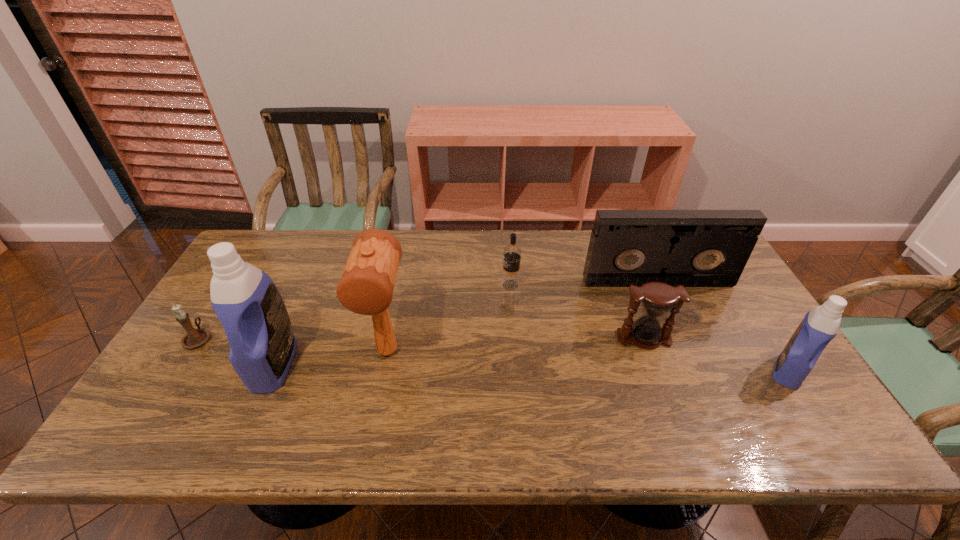
If equal spacing is desired by inserting an extra detergent among them, please point out a free spot for this new detergent. Please provide its 2D coordinates. Your answer should be formatted as a tuple, i.e. [(x, y)], where the tuple contains the x and y coordinates of a point satisfying the conditions above.

[(529, 368)]